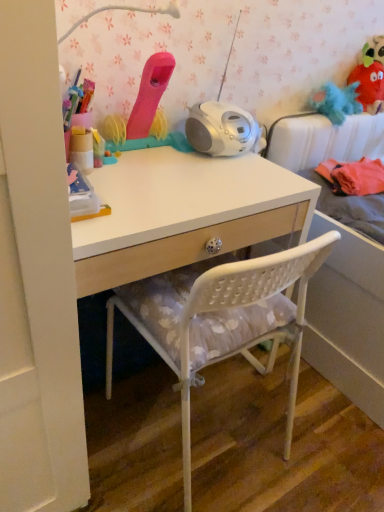
The image size is (384, 512). In order to click on empty space that is ontop of white matte desk at center (from a real-world perspective) in this screenshot , I will do `click(175, 176)`.